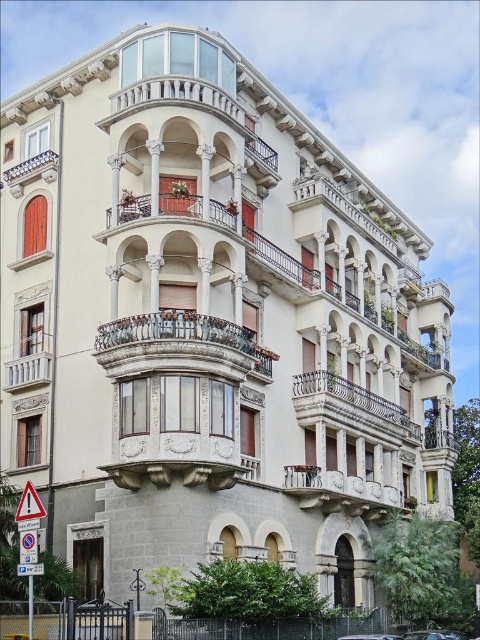
You are a delivery person trying to park your metallic silver car at lower center near the building. However, there is a white stone balcony at center above it. Is there enough vertical space between the balcony and the ground for the car to park without hitting the balcony?

The white stone balcony at center is located above the metallic silver car at lower center, so there is enough vertical space between them for the car to park safely without hitting the balcony.

You are standing in front of the building and notice the rustic wrought iron balcony at center and the yellow plastic triangle at lower left. Which object is positioned to the right side from your perspective?

The rustic wrought iron balcony at center is positioned to the right of the yellow plastic triangle at lower left.